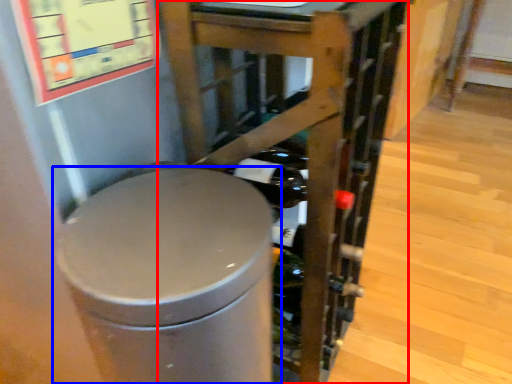
Question: Which object appears farthest to the camera in this image, furniture (highlighted by a red box) or waste container (highlighted by a blue box)?

Choices:
 (A) furniture
 (B) waste container

Answer: (A)